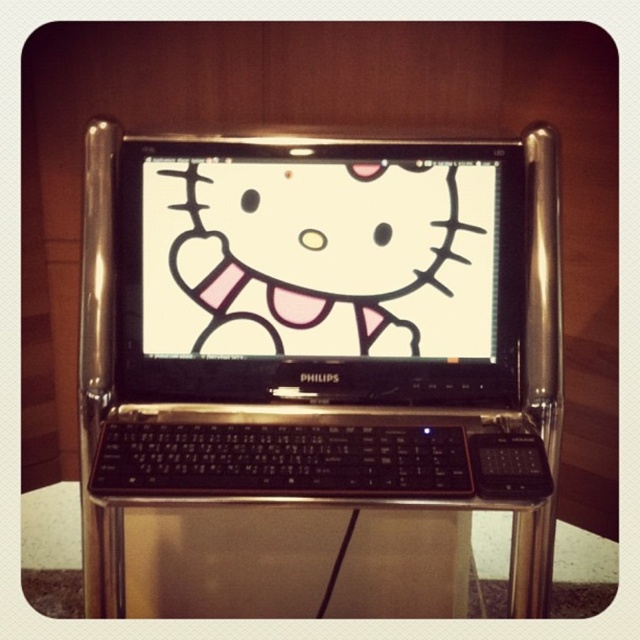
Question: Which of the following is the farthest from the observer?

Choices:
 (A) black plastic laptop at center
 (B) white matte hello kitty at center

Answer: (B)

Question: Is black plastic laptop at center wider than white matte hello kitty at center?

Choices:
 (A) no
 (B) yes

Answer: (B)

Question: Can you confirm if white matte hello kitty at center is smaller than matte white face at center?

Choices:
 (A) yes
 (B) no

Answer: (B)

Question: Considering the relative positions of black plastic laptop at center and white matte hello kitty at center in the image provided, where is black plastic laptop at center located with respect to white matte hello kitty at center?

Choices:
 (A) right
 (B) left

Answer: (A)

Question: Among these points, which one is nearest to the camera?

Choices:
 (A) (218, 304)
 (B) (378, 337)

Answer: (A)

Question: Which object is positioned closest to the white matte hello kitty at center?

Choices:
 (A) black plastic laptop at center
 (B) matte white face at center

Answer: (B)